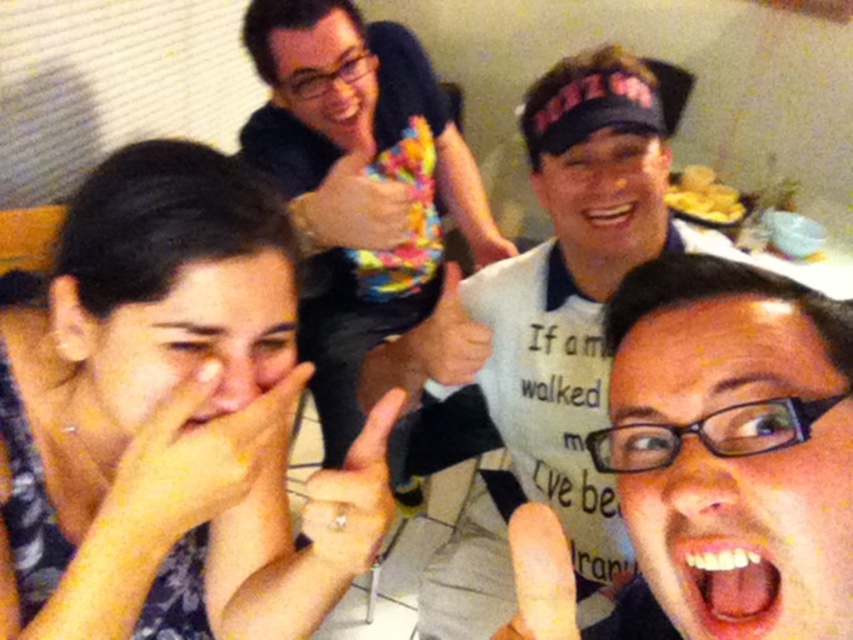
Who is positioned more to the left, floral fabric face at lower left or white cotton shirt at center?

floral fabric face at lower left is more to the left.

Which is more to the right, floral fabric face at lower left or white cotton shirt at center?

white cotton shirt at center

Does point (392, 404) come farther from viewer compared to point (593, 554)?

That is False.

Where is `floral fabric face at lower left`? The image size is (853, 640). floral fabric face at lower left is located at coordinates (170, 420).

Which of these two, floral fabric face at lower left or multicolored plush toy at upper center, stands shorter?

floral fabric face at lower left is shorter.

Who is more forward, (33, 420) or (326, 445)?

Point (33, 420) is in front.

What do you see at coordinates (170, 420) in the screenshot? I see `floral fabric face at lower left` at bounding box center [170, 420].

Where is `floral fabric face at lower left`? floral fabric face at lower left is located at coordinates (170, 420).

In the scene shown: Is white cotton shirt at center above multicolored plush toy at upper center?

Actually, white cotton shirt at center is below multicolored plush toy at upper center.

Who is higher up, white cotton shirt at center or multicolored plush toy at upper center?

multicolored plush toy at upper center

Is point (578, 560) behind point (340, 237)?

That is True.

Image resolution: width=853 pixels, height=640 pixels. I want to click on white cotton shirt at center, so click(x=561, y=300).